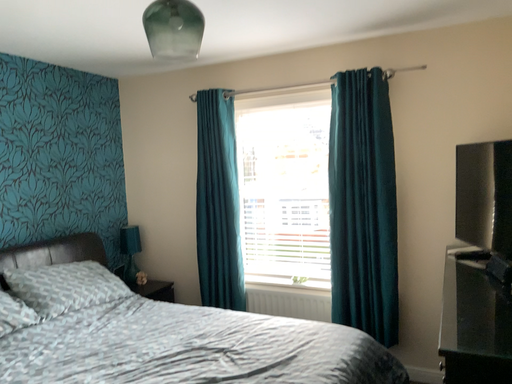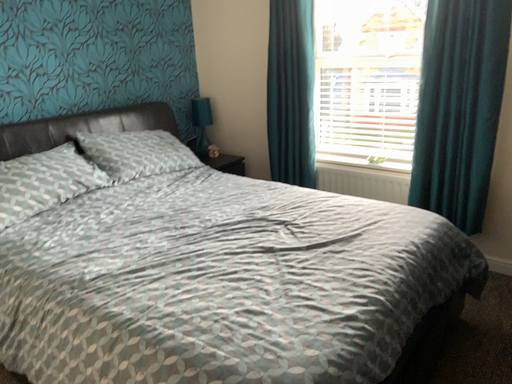
Question: Which way did the camera rotate in the video?

Choices:
 (A) rotated downward
 (B) rotated upward

Answer: (A)